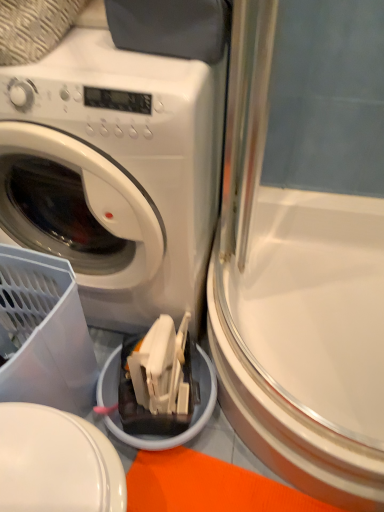
Question: Does white glossy screen door at lower right have a smaller size compared to white glossy washing machine at upper left?

Choices:
 (A) yes
 (B) no

Answer: (A)

Question: Can you confirm if white glossy screen door at lower right is positioned to the right of white glossy washing machine at upper left?

Choices:
 (A) yes
 (B) no

Answer: (A)

Question: From a real-world perspective, is white glossy screen door at lower right located beneath white glossy washing machine at upper left?

Choices:
 (A) yes
 (B) no

Answer: (A)

Question: From the image's perspective, is white glossy screen door at lower right beneath white glossy washing machine at upper left?

Choices:
 (A) no
 (B) yes

Answer: (B)

Question: From a real-world perspective, does white glossy screen door at lower right stand above white glossy washing machine at upper left?

Choices:
 (A) no
 (B) yes

Answer: (A)

Question: Does white glossy screen door at lower right have a lesser height compared to white glossy washing machine at upper left?

Choices:
 (A) yes
 (B) no

Answer: (A)

Question: Is white glossy washing machine at upper left shorter than white glossy screen door at lower right?

Choices:
 (A) no
 (B) yes

Answer: (A)

Question: Is white glossy washing machine at upper left to the right of white glossy screen door at lower right from the viewer's perspective?

Choices:
 (A) yes
 (B) no

Answer: (B)

Question: Is white glossy washing machine at upper left taller than white glossy screen door at lower right?

Choices:
 (A) no
 (B) yes

Answer: (B)

Question: Is white glossy washing machine at upper left aimed at white glossy screen door at lower right?

Choices:
 (A) yes
 (B) no

Answer: (B)

Question: Can you confirm if white glossy washing machine at upper left is bigger than white glossy screen door at lower right?

Choices:
 (A) no
 (B) yes

Answer: (B)

Question: From the image's perspective, is white glossy washing machine at upper left on top of white glossy screen door at lower right?

Choices:
 (A) no
 (B) yes

Answer: (B)

Question: In terms of width, does white glossy washing machine at upper left look wider or thinner when compared to white glossy screen door at lower right?

Choices:
 (A) thin
 (B) wide

Answer: (A)